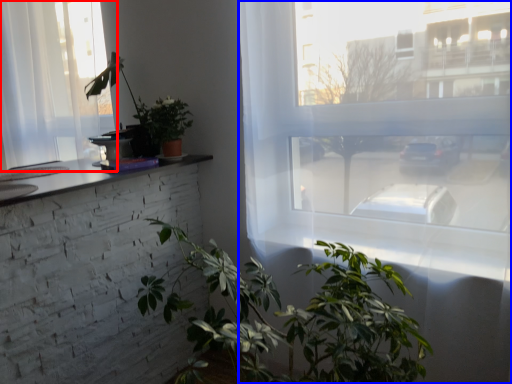
Question: Which of the following is the farthest to the observer, window (highlighted by a red box) or window (highlighted by a blue box)?

Choices:
 (A) window
 (B) window

Answer: (A)